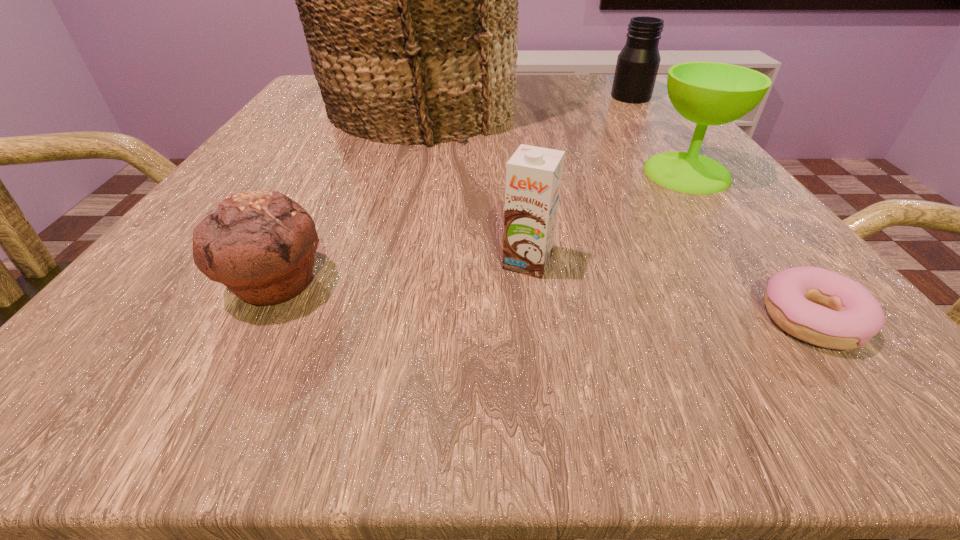
Where is `free space at the far right corner`? The height and width of the screenshot is (540, 960). free space at the far right corner is located at coordinates (604, 87).

The image size is (960, 540). Find the location of `vacant area at the near right corner of the desktop`. vacant area at the near right corner of the desktop is located at coordinates (734, 356).

The height and width of the screenshot is (540, 960). Identify the location of vacant space that's between the second shortest object and the tallest object. (347, 195).

At what (x,y) coordinates should I click in order to perform the action: click on vacant area that lies between the chocolate milk and the jar. Please return your answer as a coordinate pair (x, y). The image size is (960, 540). Looking at the image, I should click on (579, 179).

What are the coordinates of `free spot between the muffin and the basket` in the screenshot? It's located at pos(347,195).

Locate an element on the screen. free space between the jar and the third farthest object is located at coordinates (659, 135).

Find the location of a particular element. The width and height of the screenshot is (960, 540). empty space that is in between the jar and the shortest object is located at coordinates (721, 208).

Identify the location of free space between the wineglass and the jar. This screenshot has height=540, width=960. (659, 135).

I want to click on empty space between the fourth nearest object and the chocolate milk, so [607, 218].

At what (x,y) coordinates should I click in order to perform the action: click on vacant point located between the jar and the doughnut. Please return your answer as a coordinate pair (x, y). The image size is (960, 540). Looking at the image, I should click on (721, 208).